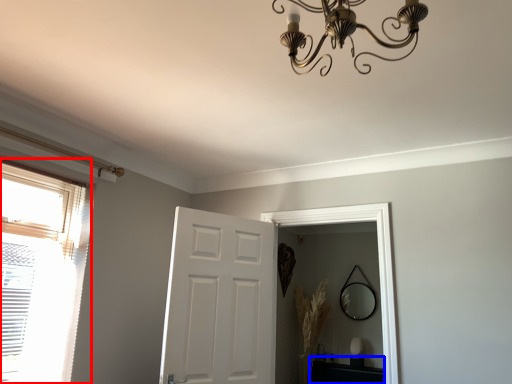
Question: Which object appears closest to the camera in this image, window (highlighted by a red box) or table (highlighted by a blue box)?

Choices:
 (A) window
 (B) table

Answer: (A)